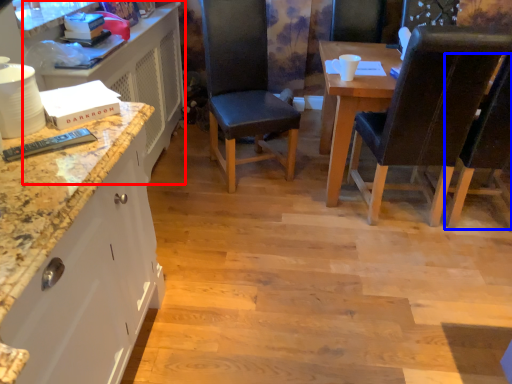
Question: Which object appears farthest to the camera in this image, dresser (highlighted by a red box) or chair (highlighted by a blue box)?

Choices:
 (A) dresser
 (B) chair

Answer: (A)